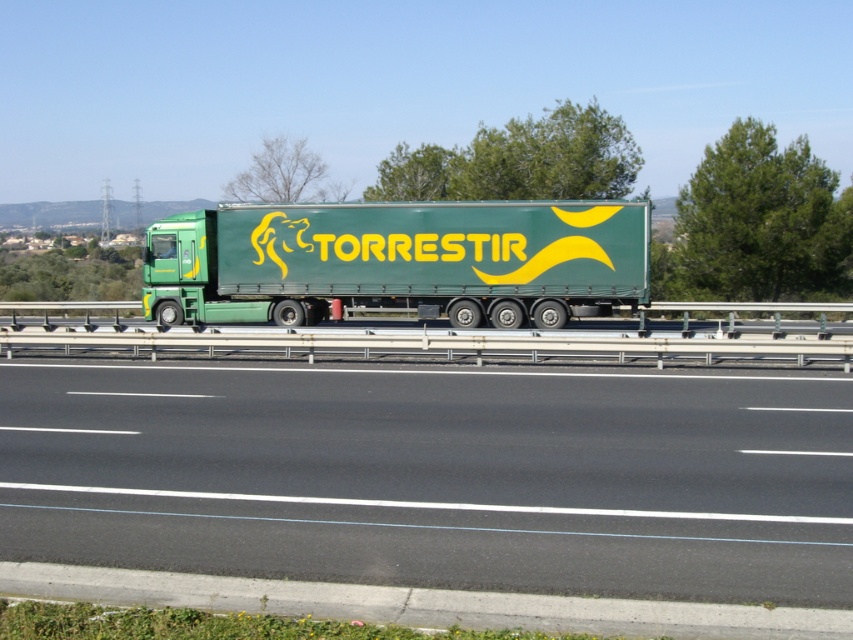
Is black asphalt highway at center to the left of green matte trailer truck at center from the viewer's perspective?

Incorrect, black asphalt highway at center is not on the left side of green matte trailer truck at center.

Who is positioned more to the right, black asphalt highway at center or green matte trailer truck at center?

black asphalt highway at center is more to the right.

Does point (378, 385) come farther from viewer compared to point (468, 202)?

That is False.

At what (x,y) coordinates should I click in order to perform the action: click on black asphalt highway at center. Please return your answer as a coordinate pair (x, y). The image size is (853, 640). Looking at the image, I should click on (436, 476).